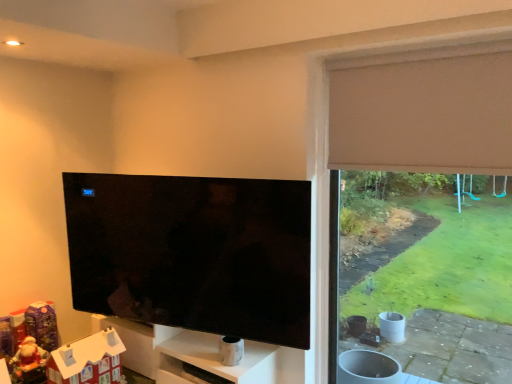
Identify the location of free point above white marble shelf at lower center (from a real-world perspective). The width and height of the screenshot is (512, 384). (214, 347).